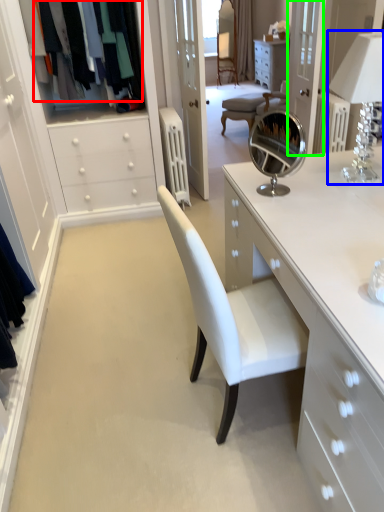
Question: Based on their relative distances, which object is farther from clothing (highlighted by a red box)? Choose from table lamp (highlighted by a blue box) and glass door (highlighted by a green box).

Choices:
 (A) table lamp
 (B) glass door

Answer: (A)